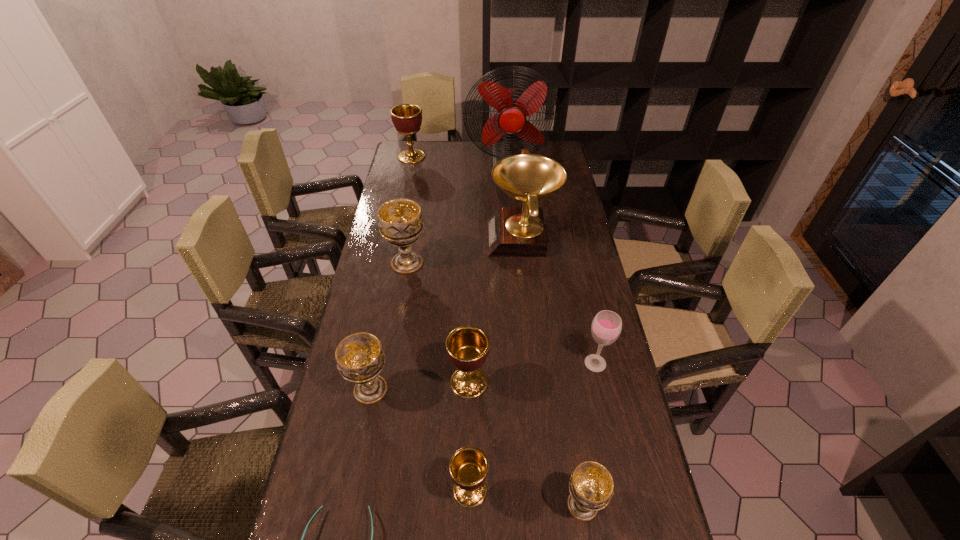
I want to click on free location located 0.180m on the front of the second biggest white chalice, so click(352, 480).

Identify the location of free region located 0.400m on the back of the nearest golden chalice. (472, 336).

The width and height of the screenshot is (960, 540). Find the location of `vacant space located on the left of the smallest white chalice`. vacant space located on the left of the smallest white chalice is located at coordinates (417, 505).

Where is `fan that is at the far edge`? fan that is at the far edge is located at coordinates (513, 106).

Locate an element on the screen. The width and height of the screenshot is (960, 540). chalice present at the far edge is located at coordinates (407, 118).

In order to click on fan located in the right edge section of the desktop in this screenshot , I will do `click(513, 106)`.

Identify the location of award located in the right edge section of the desktop. (511, 231).

The image size is (960, 540). What are the coordinates of `wineglass that is at the right edge` in the screenshot? It's located at (606, 327).

The width and height of the screenshot is (960, 540). I want to click on chalice at the right edge, so click(591, 485).

The height and width of the screenshot is (540, 960). What are the coordinates of `object that is at the far left corner` in the screenshot? It's located at (407, 118).